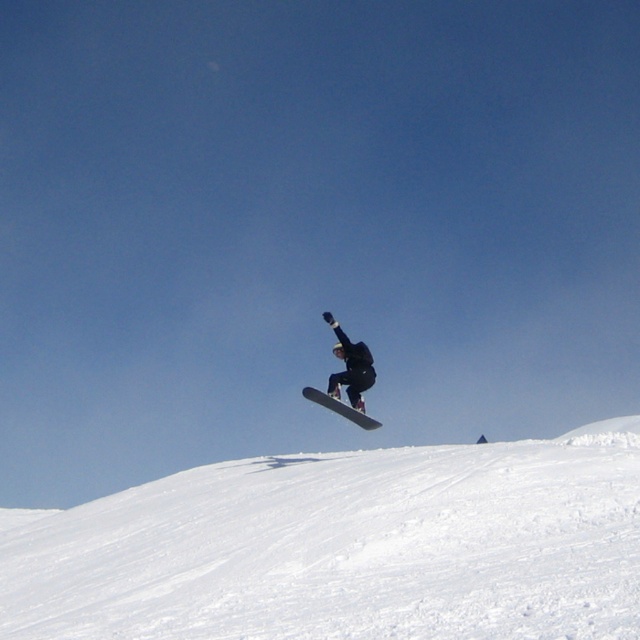
You are a drone operator trying to capture the snowboarder midair. The snowboarder is at the center of the image. You need to adjust your camera to focus on the snowboarder while avoiding the white powdery snow at lower left marked by point (346, 547). Which direction should you move the camera to avoid the snow?

The white powdery snow at lower left is located at point (346, 547). To avoid it, move the camera upwards and to the right to keep the focus on the snowboarder at the center.

You are a drone operator trying to capture the snowboarder midair. Your drone has a camera that can focus on objects within a 0.5 unit radius from its position. If you position the drone at point 0.855, 0.541, will it capture the white powdery snow at lower left in the frame?

The white powdery snow at lower left is located at point (346,547), so the drone positioned there will capture it since it is exactly at the focus point.

Looking at this image, you are a photographer trying to capture the snowboarder in midair. You notice the white powdery snow at lower left and the white matte snowboard at center. Which object is wider from your perspective?

The white powdery snow at lower left might be wider than white matte snowboard at center.